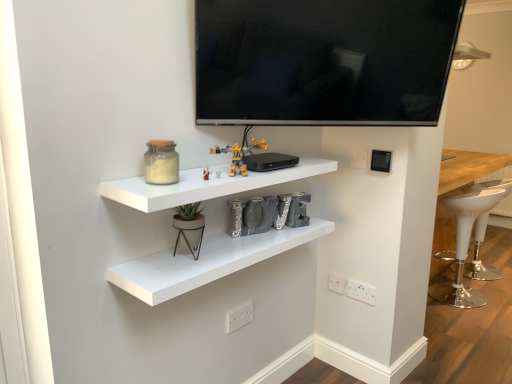
Question: From a real-world perspective, does translucent glass jar at upper left stand above white plastic electric outlet at lower center, which is the first electric outlet in back-to-front order?

Choices:
 (A) yes
 (B) no

Answer: (A)

Question: From a real-world perspective, is translucent glass jar at upper left under white plastic electric outlet at lower center, the second electric outlet from the left?

Choices:
 (A) no
 (B) yes

Answer: (A)

Question: Could you tell me if translucent glass jar at upper left is facing white plastic electric outlet at lower center, which is the 4th electric outlet in front-to-back order?

Choices:
 (A) no
 (B) yes

Answer: (A)

Question: Can you confirm if translucent glass jar at upper left is shorter than white plastic electric outlet at lower center, the second electric outlet from the left?

Choices:
 (A) yes
 (B) no

Answer: (B)

Question: Is translucent glass jar at upper left thinner than white plastic electric outlet at lower center, the 2th electric outlet viewed from the top?

Choices:
 (A) no
 (B) yes

Answer: (A)

Question: Is white plastic electric outlet at lower center, which is the first electric outlet in back-to-front order, completely or partially inside translucent glass jar at upper left?

Choices:
 (A) no
 (B) yes

Answer: (A)

Question: Does translucent glass jar at upper left have a greater height compared to white plastic electric outlet at lower right, which is the 1th electric outlet in right-to-left order?

Choices:
 (A) no
 (B) yes

Answer: (B)

Question: Is translucent glass jar at upper left smaller than white plastic electric outlet at lower right, which is the third electric outlet in front-to-back order?

Choices:
 (A) yes
 (B) no

Answer: (B)

Question: From a real-world perspective, is translucent glass jar at upper left physically below white plastic electric outlet at lower right, arranged as the 3th electric outlet when viewed from the top?

Choices:
 (A) yes
 (B) no

Answer: (B)

Question: From the image's perspective, does translucent glass jar at upper left appear higher than white plastic electric outlet at lower right, acting as the 4th electric outlet starting from the left?

Choices:
 (A) yes
 (B) no

Answer: (A)

Question: Does translucent glass jar at upper left come behind white plastic electric outlet at lower right, acting as the 2th electric outlet starting from the bottom?

Choices:
 (A) yes
 (B) no

Answer: (B)

Question: Can we say translucent glass jar at upper left lies outside white plastic electric outlet at lower right, which is the 1th electric outlet in right-to-left order?

Choices:
 (A) no
 (B) yes

Answer: (B)

Question: From the image's perspective, is white plastic electric outlet at lower center, which is counted as the first electric outlet, starting from the top, located above white matte shelf at center, the second shelf in the bottom-to-top sequence?

Choices:
 (A) no
 (B) yes

Answer: (B)